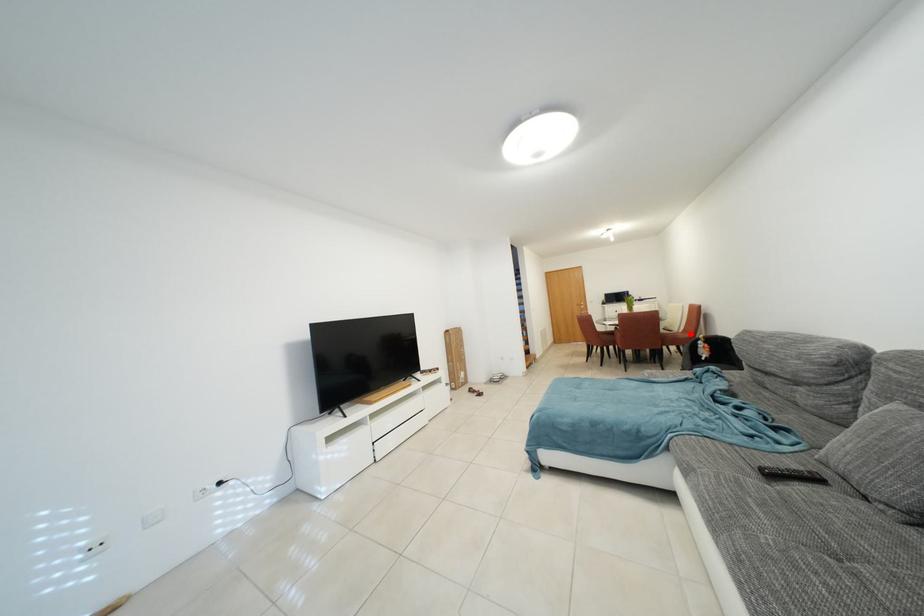
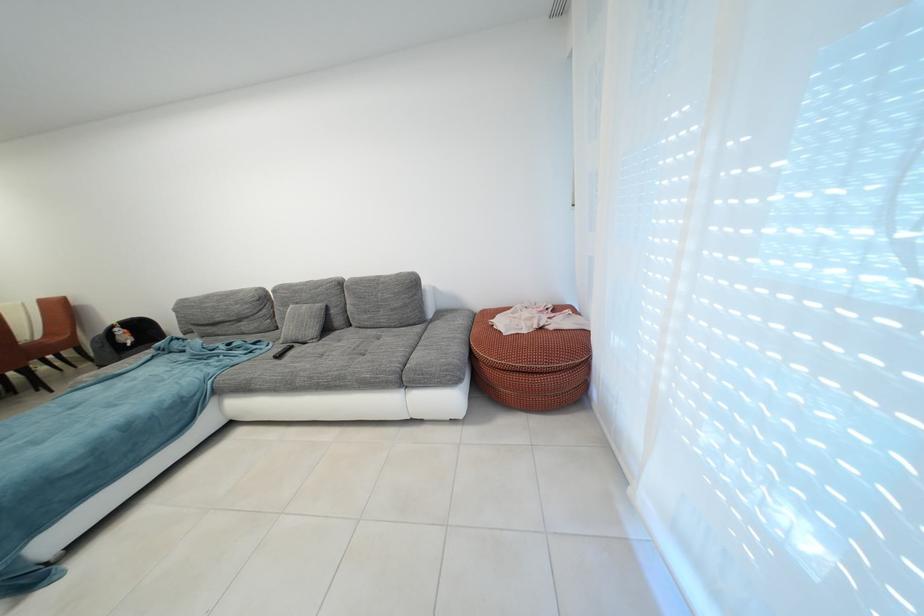
Where in the second image is the point corresponding to the highlighted location from the first image?

(45, 341)